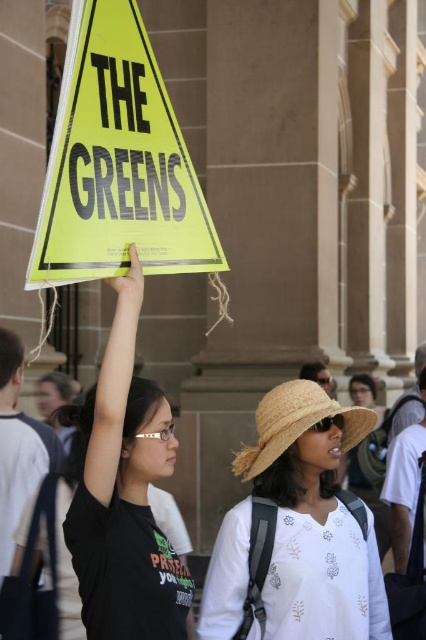
You are standing at the entrance of the building in the image. There is a point marked at coordinates (313,518). What object is located at that point?

The point at coordinates (313,518) marks the location of the straw hat at center.